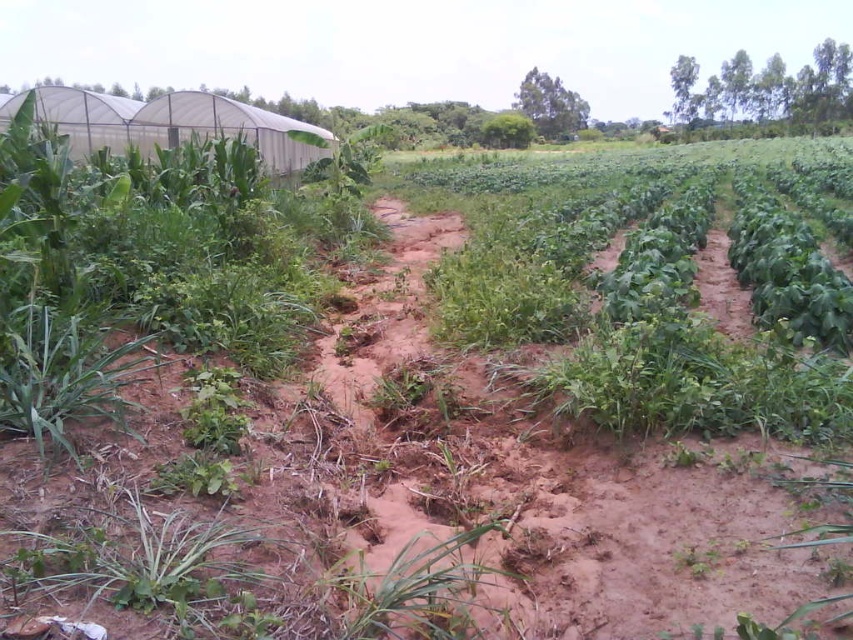
Is green leafy plant at lower left below green grass at center?

No, green leafy plant at lower left is not below green grass at center.

I want to click on green leafy plant at lower left, so click(152, 570).

Identify the location of green leafy plant at lower left. (152, 570).